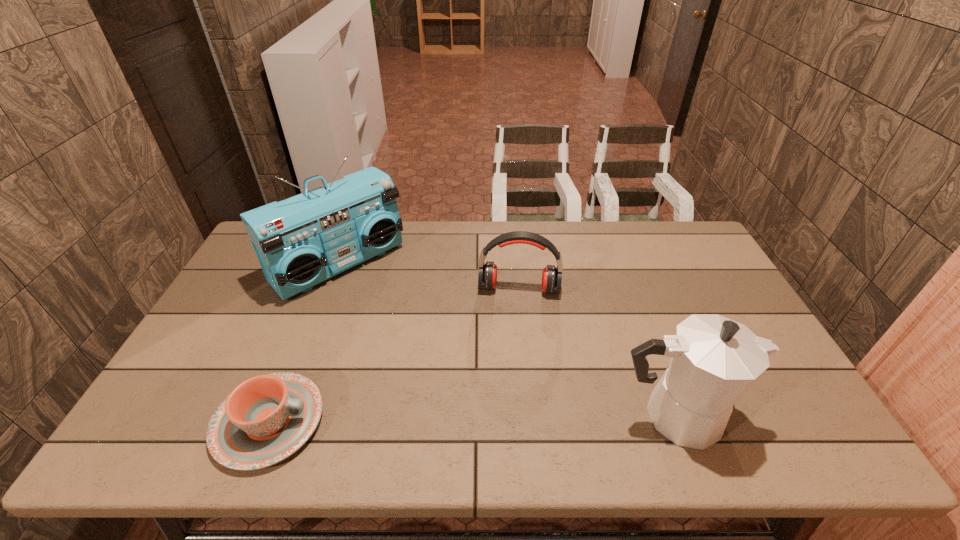
Locate an element on the screen. Image resolution: width=960 pixels, height=540 pixels. vacant space at the left edge of the desktop is located at coordinates (233, 335).

I want to click on free space at the far right corner of the desktop, so click(x=693, y=228).

Locate an element on the screen. The image size is (960, 540). free spot between the rightmost object and the chinaware is located at coordinates (471, 419).

This screenshot has width=960, height=540. I want to click on free spot between the third shortest object and the second object from right to left, so click(x=596, y=352).

Where is `free spot between the shortest object and the radio receiver`? free spot between the shortest object and the radio receiver is located at coordinates (304, 343).

Where is `empty space between the third object from left to right and the radio receiver`? The image size is (960, 540). empty space between the third object from left to right and the radio receiver is located at coordinates (429, 276).

Find the location of a particular element. This screenshot has height=540, width=960. vacant area that lies between the radio receiver and the earphone is located at coordinates (429, 276).

The height and width of the screenshot is (540, 960). What are the coordinates of `empty space that is in between the coffeepot and the third object from left to right` in the screenshot? It's located at (596, 352).

Locate an element on the screen. Image resolution: width=960 pixels, height=540 pixels. vacant region between the coffeepot and the radio receiver is located at coordinates (506, 340).

Identify the location of free space that is in between the rightmost object and the radio receiver. This screenshot has width=960, height=540. (506, 340).